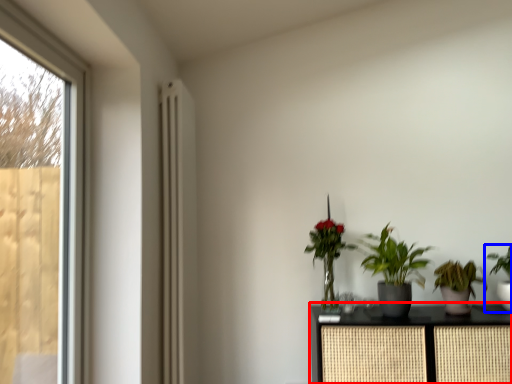
Question: Among these objects, which one is farthest to the camera, furniture (highlighted by a red box) or houseplant (highlighted by a blue box)?

Choices:
 (A) furniture
 (B) houseplant

Answer: (B)